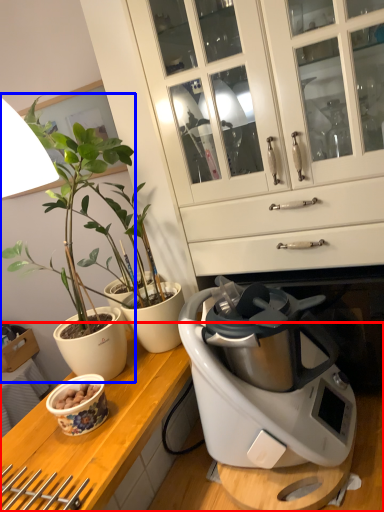
Question: Which object is further to the camera taking this photo, countertop (highlighted by a red box) or houseplant (highlighted by a blue box)?

Choices:
 (A) countertop
 (B) houseplant

Answer: (B)